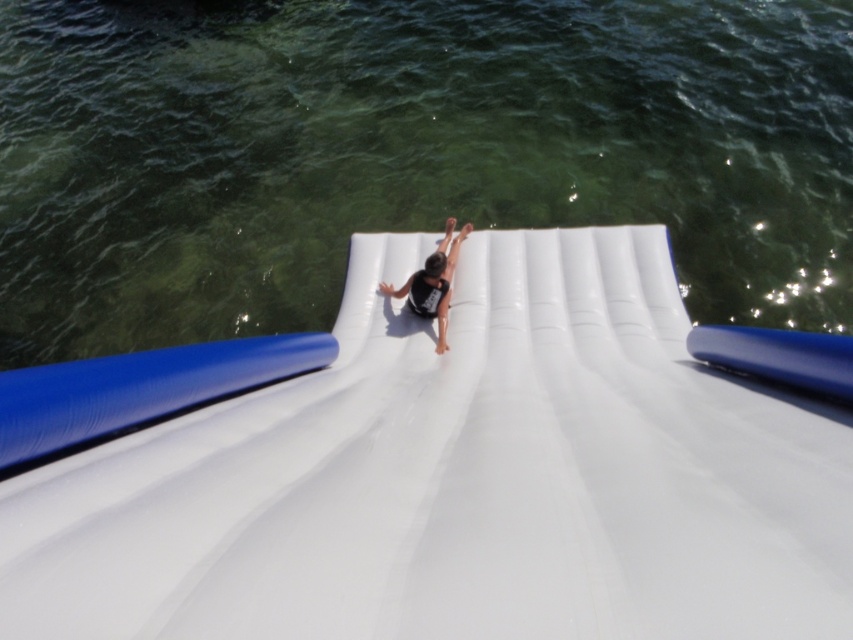
Is point (772, 412) positioned in front of point (451, 218)?

Yes, it is in front of point (451, 218).

Between point (587, 364) and point (438, 275), which one is positioned in front?

Point (587, 364) is more forward.

Does point (57, 499) come farther from viewer compared to point (422, 316)?

No, (57, 499) is closer to viewer.

Where is `white rubber slide at center`? white rubber slide at center is located at coordinates (457, 477).

The height and width of the screenshot is (640, 853). What do you see at coordinates (405, 152) in the screenshot?
I see `clear water at upper center` at bounding box center [405, 152].

Does point (28, 141) come behind point (553, 577)?

Yes, point (28, 141) is behind point (553, 577).

What do you see at coordinates (405, 152) in the screenshot?
I see `clear water at upper center` at bounding box center [405, 152].

Find the location of `clear water at upper center`. clear water at upper center is located at coordinates (405, 152).

This screenshot has width=853, height=640. What do you see at coordinates (405, 152) in the screenshot?
I see `clear water at upper center` at bounding box center [405, 152].

Which is above, clear water at upper center or black matte person at center?

Positioned higher is clear water at upper center.

Is point (138, 86) positioned after point (440, 310)?

Yes.

Find the location of a particular element. clear water at upper center is located at coordinates (405, 152).